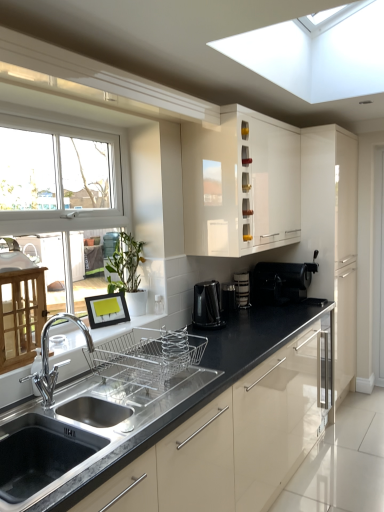
Question: Can stainless steel sink at lower left be found inside green matte plant at center?

Choices:
 (A) no
 (B) yes

Answer: (A)

Question: Would you say green matte plant at center is outside stainless steel sink at lower left?

Choices:
 (A) no
 (B) yes

Answer: (B)

Question: Can you confirm if green matte plant at center is shorter than stainless steel sink at lower left?

Choices:
 (A) yes
 (B) no

Answer: (B)

Question: Is green matte plant at center smaller than stainless steel sink at lower left?

Choices:
 (A) no
 (B) yes

Answer: (B)

Question: Is the position of green matte plant at center more distant than that of stainless steel sink at lower left?

Choices:
 (A) yes
 (B) no

Answer: (A)

Question: From the image's perspective, is stainless steel sink at lower left above or below chrome metallic faucet at lower left?

Choices:
 (A) below
 (B) above

Answer: (A)

Question: In the image, is stainless steel sink at lower left on the left side or the right side of chrome metallic faucet at lower left?

Choices:
 (A) left
 (B) right

Answer: (B)

Question: Is stainless steel sink at lower left wider or thinner than chrome metallic faucet at lower left?

Choices:
 (A) wide
 (B) thin

Answer: (A)

Question: Choose the correct answer: Is stainless steel sink at lower left inside chrome metallic faucet at lower left or outside it?

Choices:
 (A) outside
 (B) inside

Answer: (A)

Question: Is matte black coffee maker at center, marked as the 2th appliance in a left-to-right arrangement, taller or shorter than black glossy coffee machine at center, which is the second coffee machine from back to front?

Choices:
 (A) short
 (B) tall

Answer: (A)

Question: Considering the positions of point (236, 279) and point (201, 301), is point (236, 279) closer or farther from the camera than point (201, 301)?

Choices:
 (A) closer
 (B) farther

Answer: (B)

Question: Based on their positions, is matte black coffee maker at center, the first appliance in the right-to-left sequence, located to the left or right of black glossy coffee machine at center, which is the first coffee machine in front-to-back order?

Choices:
 (A) right
 (B) left

Answer: (A)

Question: Is matte black coffee maker at center, marked as the 2th appliance in a left-to-right arrangement, spatially inside black glossy coffee machine at center, which ranks as the 2th coffee machine in right-to-left order, or outside of it?

Choices:
 (A) outside
 (B) inside

Answer: (A)

Question: From a real-world perspective, is black plastic coffee maker at center, acting as the first appliance starting from the left, physically located above or below black glossy coffee machine at center, arranged as the 1th coffee machine when viewed from the left?

Choices:
 (A) below
 (B) above

Answer: (A)

Question: Considering the positions of black plastic coffee maker at center, which ranks as the 2th appliance in right-to-left order, and black glossy coffee machine at center, which ranks as the 2th coffee machine in right-to-left order, in the image, is black plastic coffee maker at center, which ranks as the 2th appliance in right-to-left order, taller or shorter than black glossy coffee machine at center, which ranks as the 2th coffee machine in right-to-left order,?

Choices:
 (A) tall
 (B) short

Answer: (B)